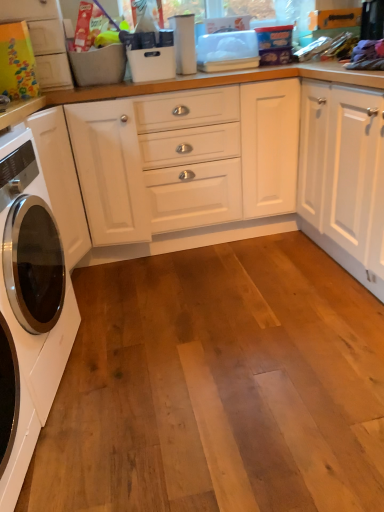
What are the coordinates of `free point to the right of white glossy washing machine at left` in the screenshot? It's located at (140, 358).